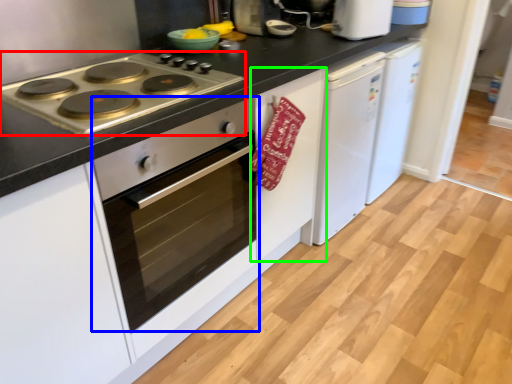
Question: Which object is positioned farthest from gas stove (highlighted by a red box)? Select from oven (highlighted by a blue box) and cabinetry (highlighted by a green box).

Choices:
 (A) oven
 (B) cabinetry

Answer: (B)